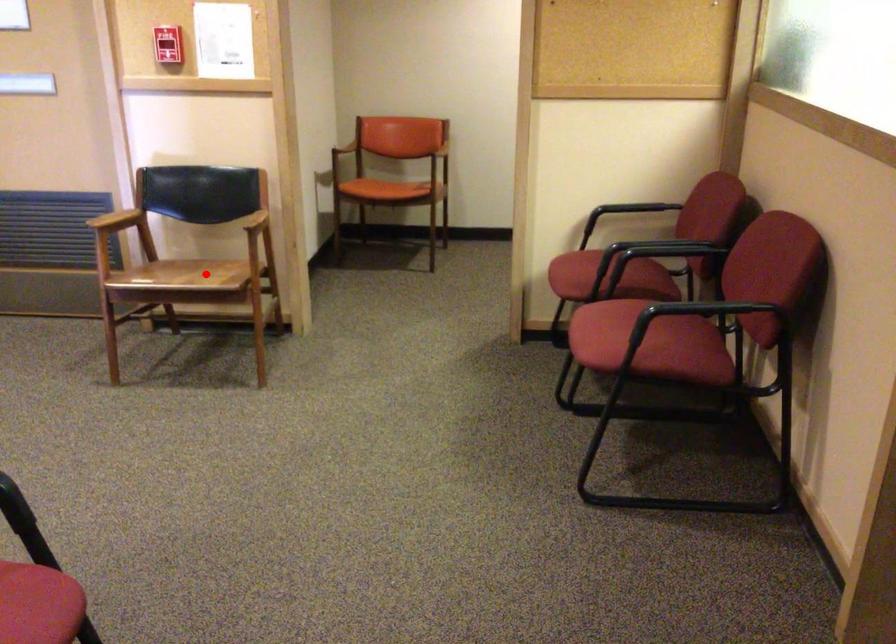
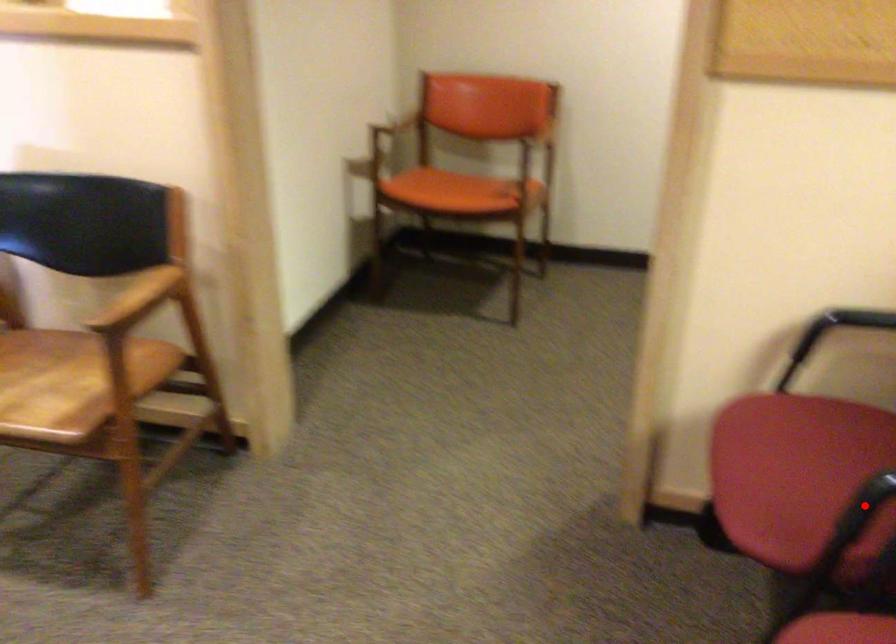
I am providing you with two images of the same scene from different viewpoints. A red point is marked on the first image and another point is marked on the second image. Are the points marked in image1 and image2 representing the same 3D position?

No